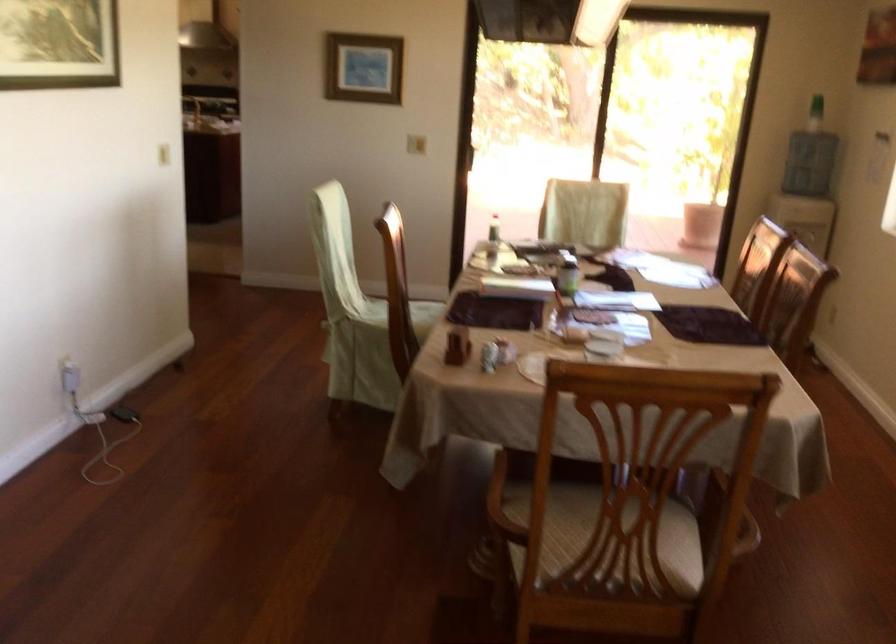
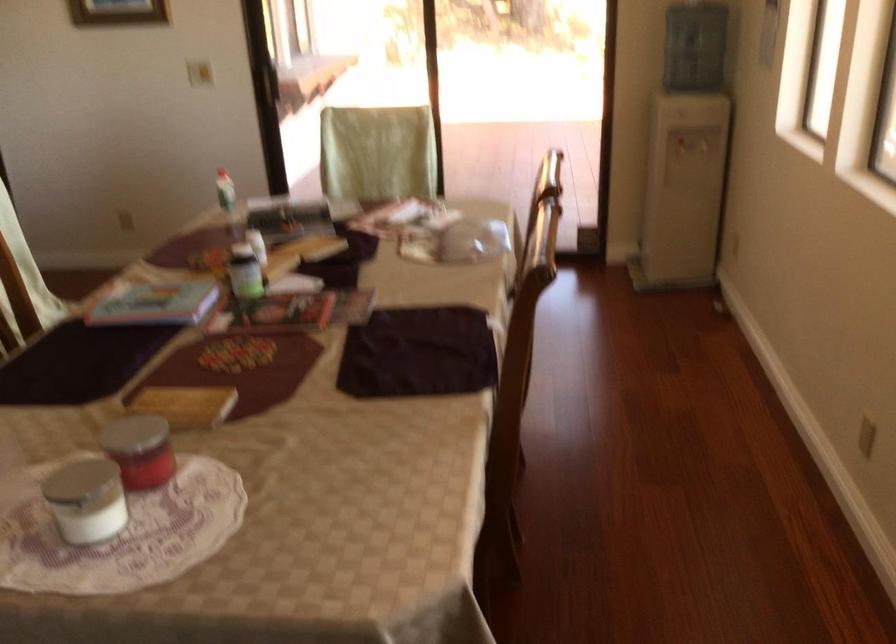
Where in the second image is the point corresponding to (x=617, y=352) from the first image?

(162, 465)